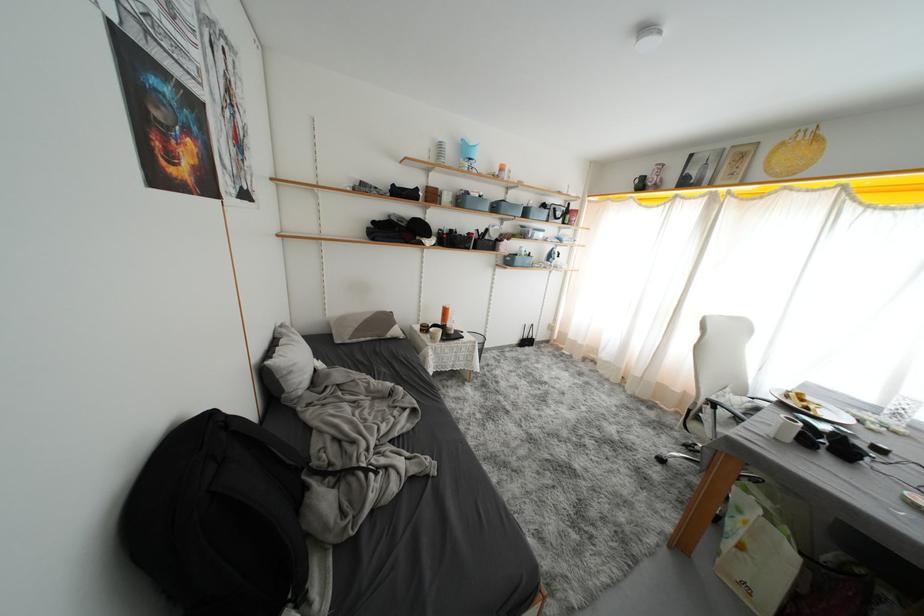
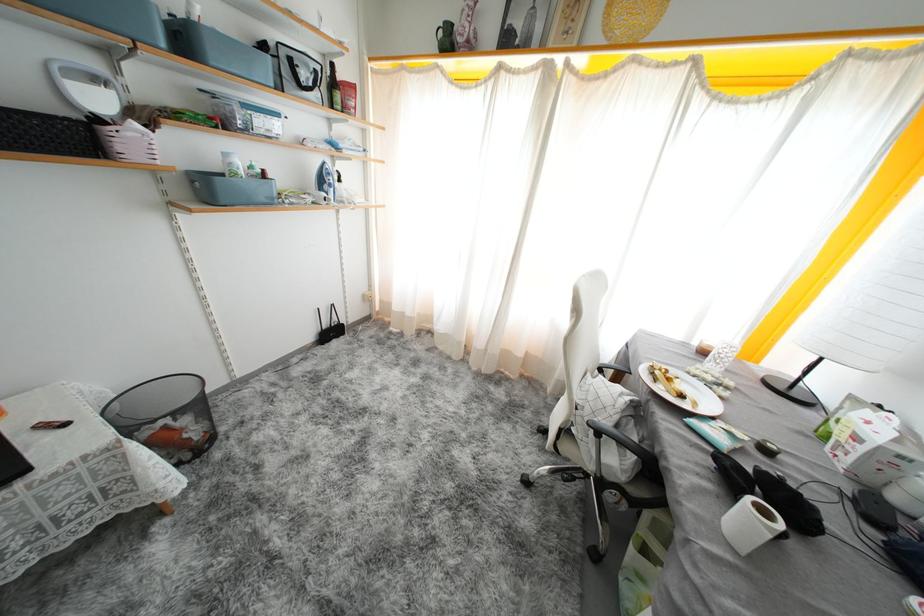
Locate, in the second image, the point that corresponds to pixel 886 455 in the first image.

(773, 455)